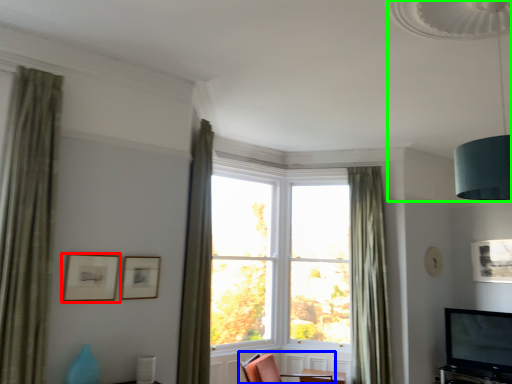
Question: Which object is the closest to the picture frame (highlighted by a red box)? Choose among these: chair (highlighted by a blue box) or lamp (highlighted by a green box).

Choices:
 (A) chair
 (B) lamp

Answer: (A)